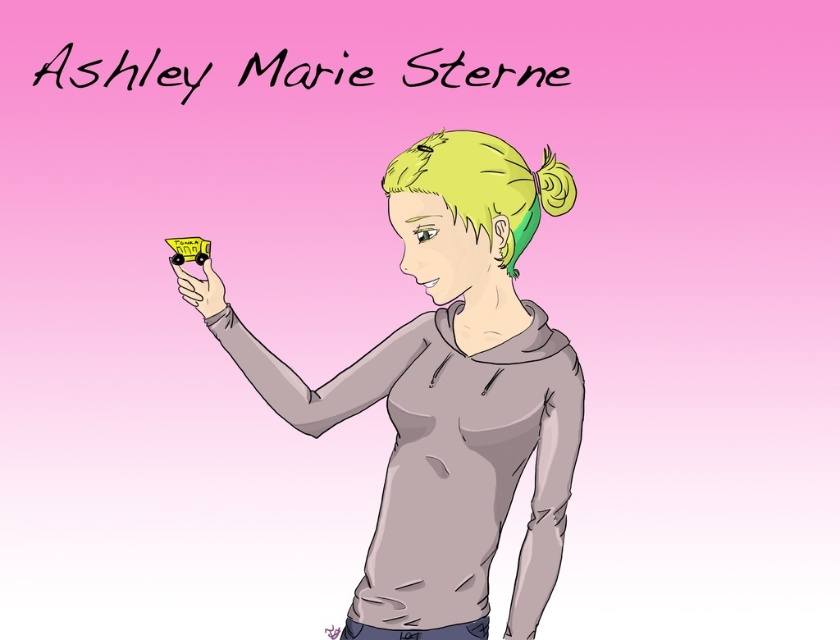
You are playing with two matte yellow toys in your hand. The matte yellow toy truck at upper left and the matte yellow toy car at center. Which one is wider?

The matte yellow toy truck at upper left is wider than the matte yellow toy car at center.

You are playing with two matte yellow toys. The matte yellow toy truck at upper left and the matte yellow toy car at center. Which one is bigger?

The matte yellow toy truck at upper left is larger in size than the matte yellow toy car at center.